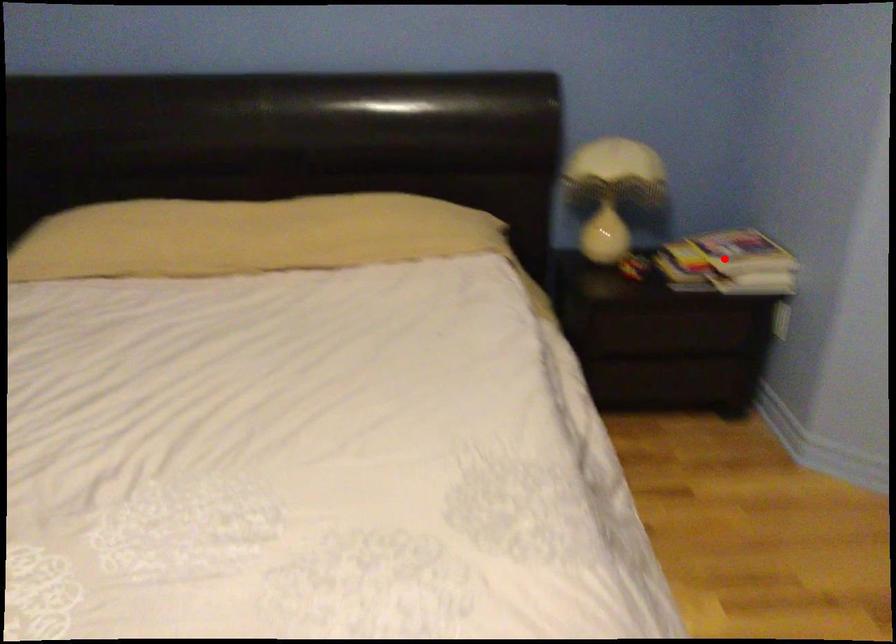
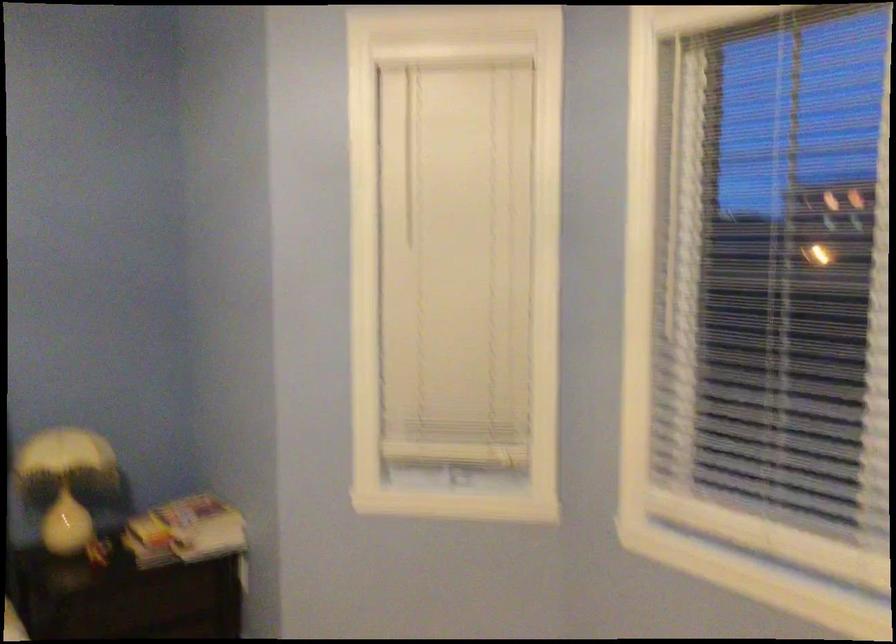
Question: I am providing you with two images of the same scene from different viewpoints. Image1 has a red point marked. In image2, the corresponding 3D location appears at what relative position? Reply with the corresponding letter.

Choices:
 (A) Closer
 (B) Farther

Answer: (B)